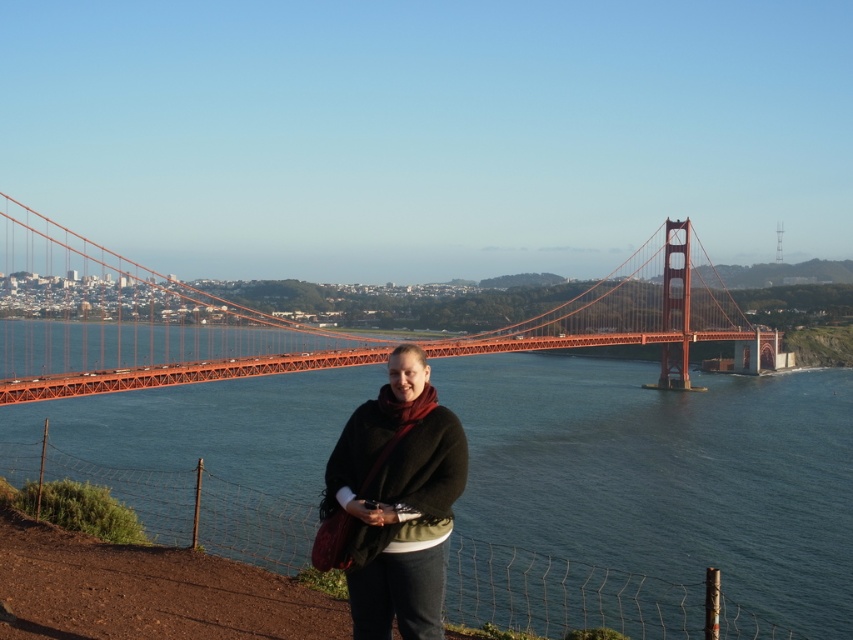
Is orange painted steel golden gate bridge at center bigger than dark brown woolen shawl at center?

Correct, orange painted steel golden gate bridge at center is larger in size than dark brown woolen shawl at center.

Is orange painted steel golden gate bridge at center above dark brown woolen shawl at center?

Correct, orange painted steel golden gate bridge at center is located above dark brown woolen shawl at center.

Does point (22, 388) lie in front of point (444, 410)?

No, it is behind (444, 410).

The width and height of the screenshot is (853, 640). What are the coordinates of `orange painted steel golden gate bridge at center` in the screenshot? It's located at (137, 324).

Between glossy water at center and orange painted steel golden gate bridge at center, which one appears on the left side from the viewer's perspective?

A: orange painted steel golden gate bridge at center is more to the left.

This screenshot has width=853, height=640. What do you see at coordinates (648, 496) in the screenshot? I see `glossy water at center` at bounding box center [648, 496].

This screenshot has height=640, width=853. What are the coordinates of `glossy water at center` in the screenshot? It's located at (648, 496).

Between point (303, 483) and point (393, 372), which one is positioned behind?

The point (303, 483) is more distant.

Does glossy water at center lie behind dark brown woolen shawl at center?

Yes, glossy water at center is further from the viewer.

Between point (537, 582) and point (410, 554), which one is positioned in front?

Positioned in front is point (410, 554).

The image size is (853, 640). In order to click on glossy water at center in this screenshot , I will do `click(648, 496)`.